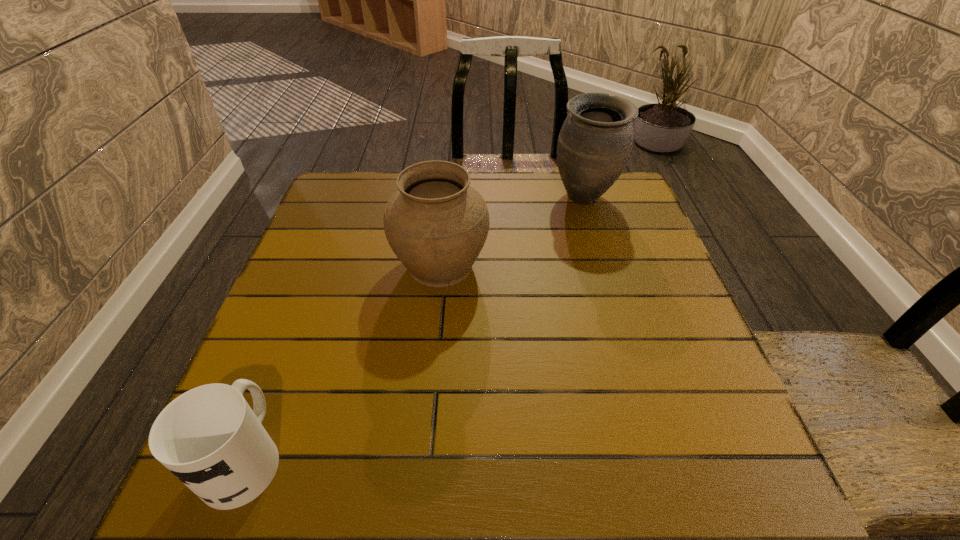
You are a GUI agent. You are given a task and a screenshot of the screen. Output one action in this format:
    pyautogui.click(x=<x>, y=<y>)
    Task: Click on the free space between the farther urn and the second farthest object
    This screenshot has height=540, width=960.
    Given the screenshot: What is the action you would take?
    pyautogui.click(x=513, y=231)

Locate an element on the screen. This screenshot has width=960, height=540. unoccupied area between the second nearest object and the right urn is located at coordinates (513, 231).

At what (x,y) coordinates should I click in order to perform the action: click on unoccupied position between the leftmost object and the right urn. Please return your answer as a coordinate pair (x, y). The image size is (960, 540). Looking at the image, I should click on (415, 327).

Where is `object that is the second closest to the farthest object`? object that is the second closest to the farthest object is located at coordinates (209, 437).

You are a GUI agent. You are given a task and a screenshot of the screen. Output one action in this format:
    pyautogui.click(x=<x>, y=<y>)
    Task: Click on the object that can be found as the closest to the right urn
    
    Given the screenshot: What is the action you would take?
    pyautogui.click(x=436, y=224)

Where is `vacant point that satisfies the following two spatial constraints: 1. on the handle side of the leftmost object; 2. on the left side of the right urn`? Image resolution: width=960 pixels, height=540 pixels. vacant point that satisfies the following two spatial constraints: 1. on the handle side of the leftmost object; 2. on the left side of the right urn is located at coordinates (346, 198).

The width and height of the screenshot is (960, 540). I want to click on free point that satisfies the following two spatial constraints: 1. on the handle side of the nearest object; 2. on the left side of the second farthest object, so click(x=319, y=265).

I want to click on free point that satisfies the following two spatial constraints: 1. on the handle side of the mug; 2. on the left side of the right urn, so click(x=346, y=198).

Where is `vacant space that satisfies the following two spatial constraints: 1. on the handle side of the shortest object; 2. on the left side of the rightmost object`? vacant space that satisfies the following two spatial constraints: 1. on the handle side of the shortest object; 2. on the left side of the rightmost object is located at coordinates (346, 198).

Where is `free space that satisfies the following two spatial constraints: 1. on the handle side of the shortest object; 2. on the right side of the nearer urn`? free space that satisfies the following two spatial constraints: 1. on the handle side of the shortest object; 2. on the right side of the nearer urn is located at coordinates (319, 265).